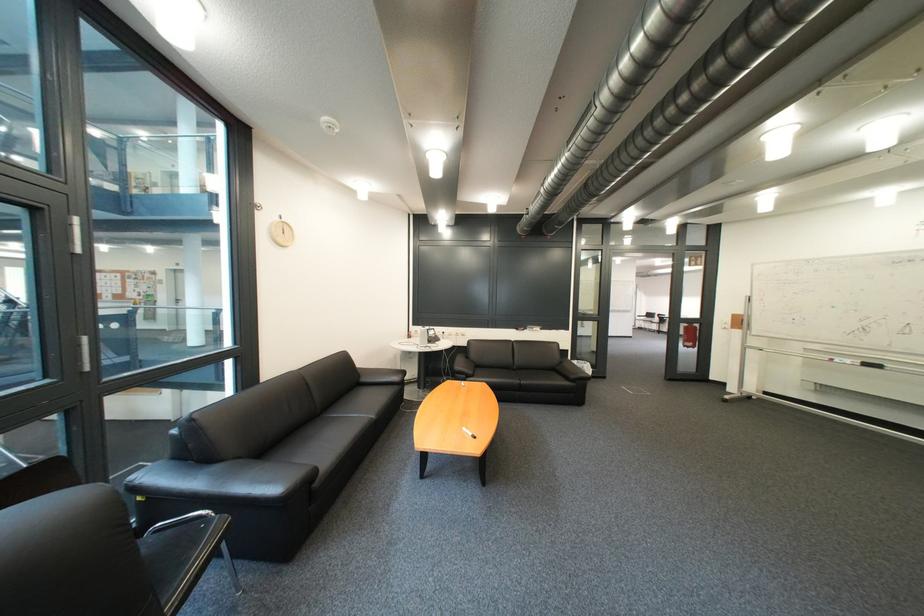
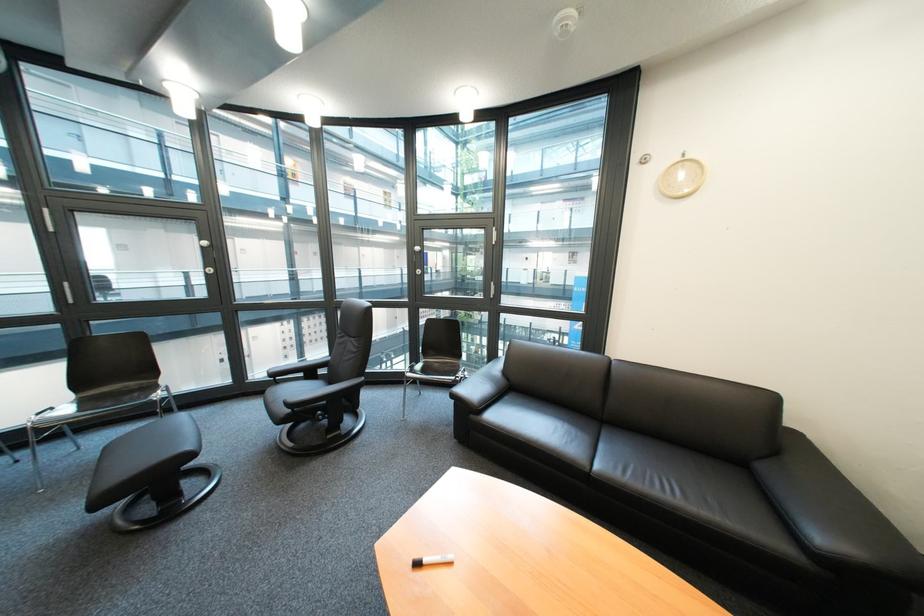
Locate, in the second image, the point that corresponds to pixel 329 485 in the first image.

(485, 418)